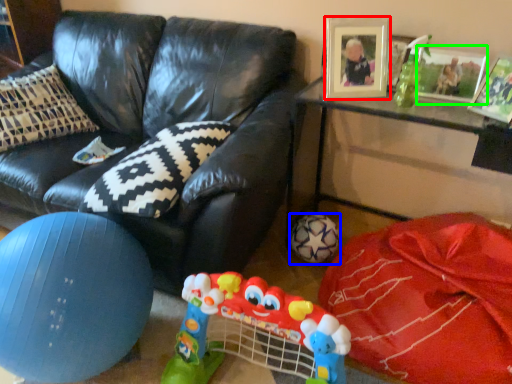
Question: Which object is the farthest from picture frame (highlighted by a red box)? Choose among these: football (highlighted by a blue box) or picture frame (highlighted by a green box).

Choices:
 (A) football
 (B) picture frame

Answer: (A)